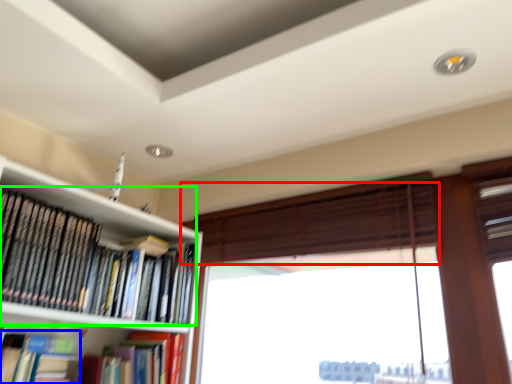
Question: Which object is positioned farthest from blind (highlighted by a red box)? Select from book (highlighted by a blue box) and book (highlighted by a green box).

Choices:
 (A) book
 (B) book

Answer: (A)